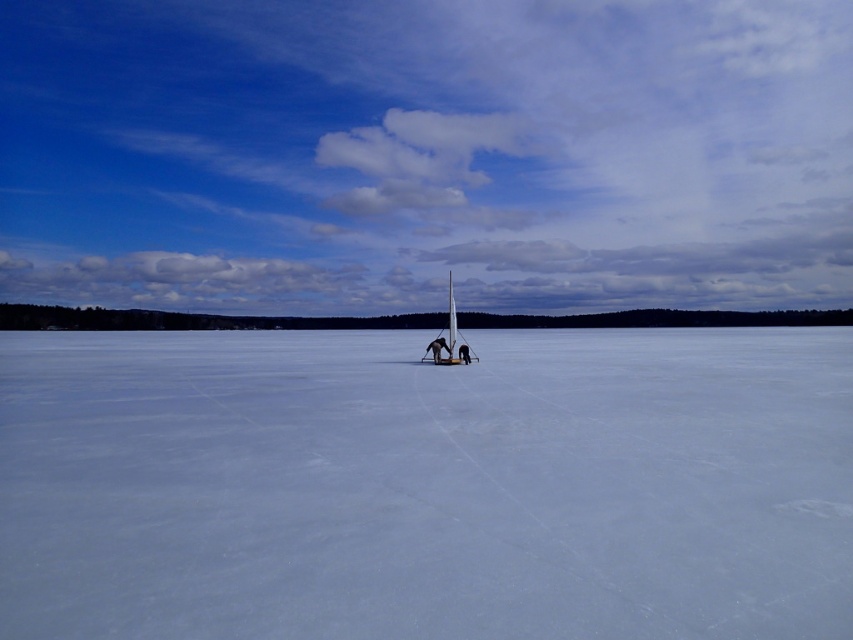
You are standing at the edge of the frozen lake and see two points marked on the ice. The first point is at coordinates point (820, 554) and the second is at point (453, 348). Which point is closer to your current position?

Point (820, 554) is closer to the camera than point (453, 348), so the first point is closer to your current position.

Consider the image. You are standing at the edge of the frozen lake in the image. There is a point marked at coordinates [427,484] which is labeled as white smooth ice at center. If you want to walk towards the sailboat near the point, will the path be safe?

The point at [427,484] is labeled as white smooth ice at center, which is safe for walking. Therefore, the path towards the sailboat near the point should be safe.